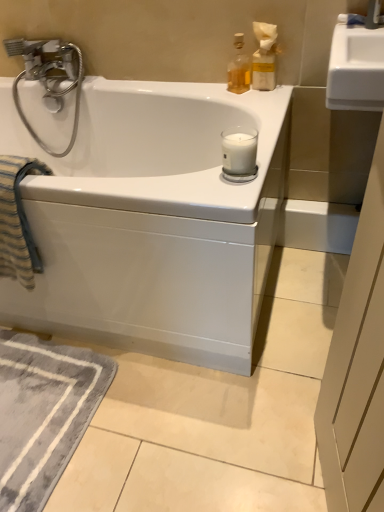
Image resolution: width=384 pixels, height=512 pixels. I want to click on blank space to the left of white matte glass candle at upper right, so click(180, 183).